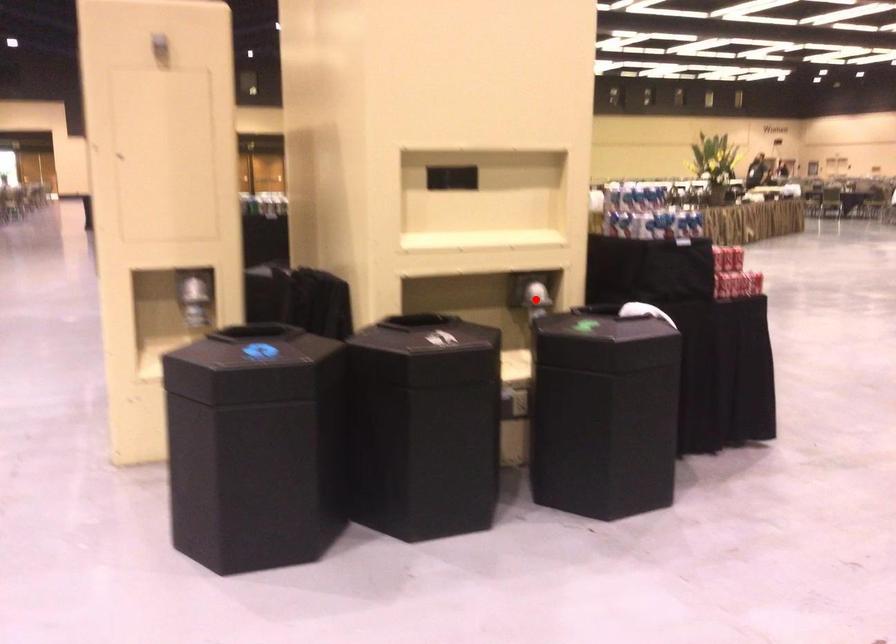
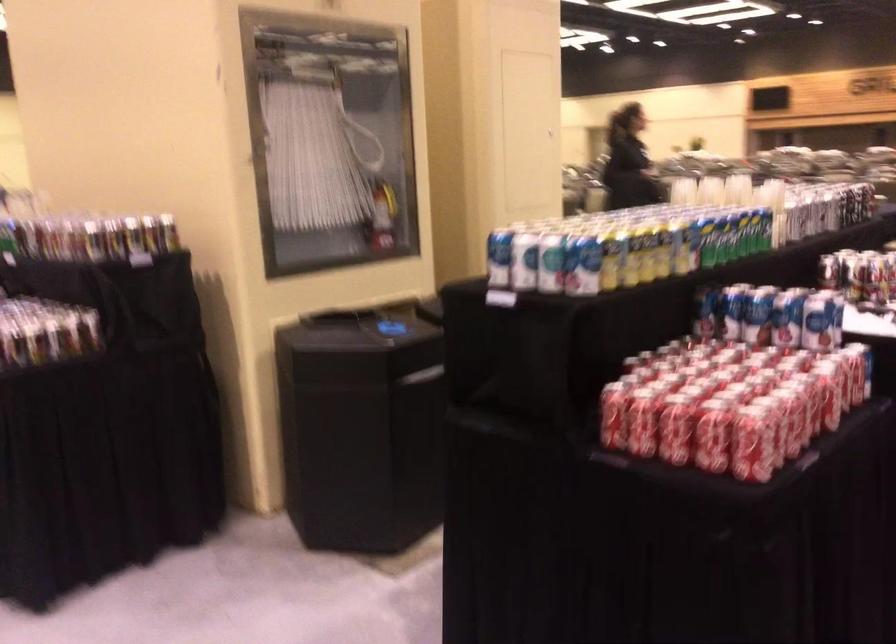
Question: I am providing you with two images of the same scene from different viewpoints. A red point is marked on the first image. Can you still see the location of the red point in image 2?

Choices:
 (A) Yes
 (B) No

Answer: (B)